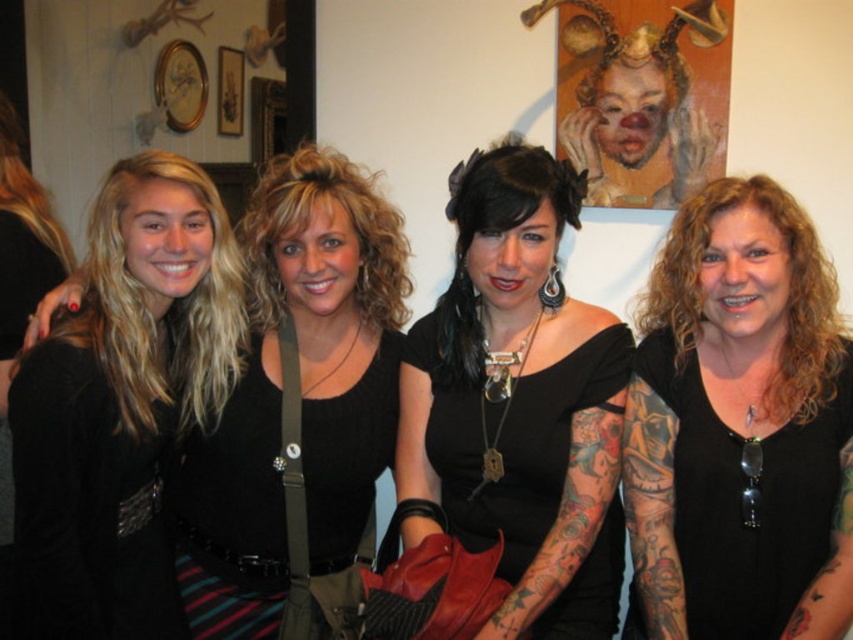
You are a photographer trying to capture a detailed shot of the black leather jacket at left. Based on its position coordinates, where should you aim your camera?

The black leather jacket at left is located at coordinates point 0.630 on the x axis and 0.145 on the y axis. Aim your camera there.

You are standing in the gallery and want to take a photo of both the black matte shirt at right and the black leather purse at center. Which object is positioned closer to you?

The black matte shirt at right is closer to the viewer than the black leather purse at center.

You are a photographer adjusting your camera settings to capture the group photo. You notice two items at the center of the image that might blur if not focused properly. Which item is closer to the camera, the black leather purse at center or the black knit top at center?

The black leather purse at center is 9.08 inches from the black knit top at center. Since the purse is closer to the camera, it will be in focus if the top is also in focus, but if the focus is set on the top, the purse might appear slightly blurred. However, the exact distance suggests they are relatively close, so adjusting the focus to a midpoint might be necessary for both to be clear.